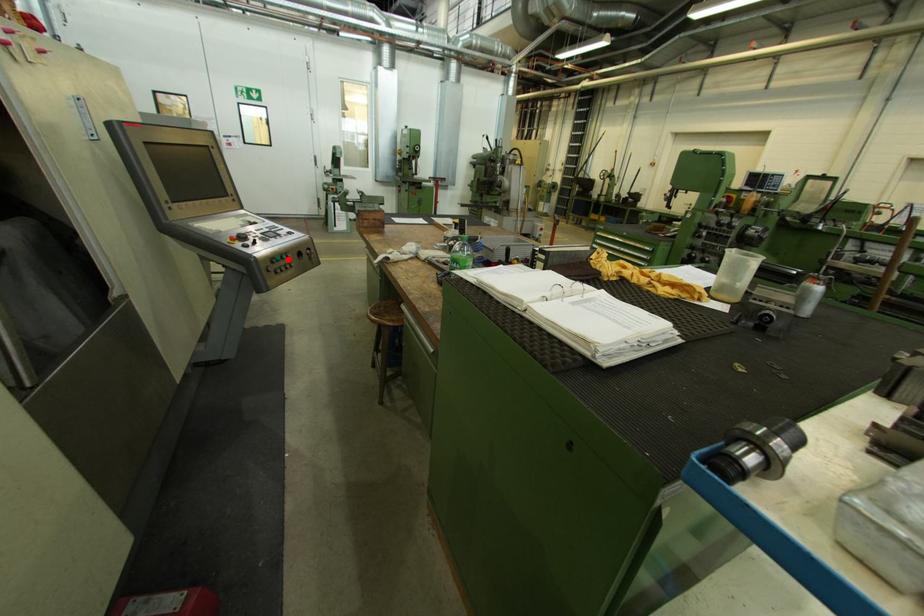
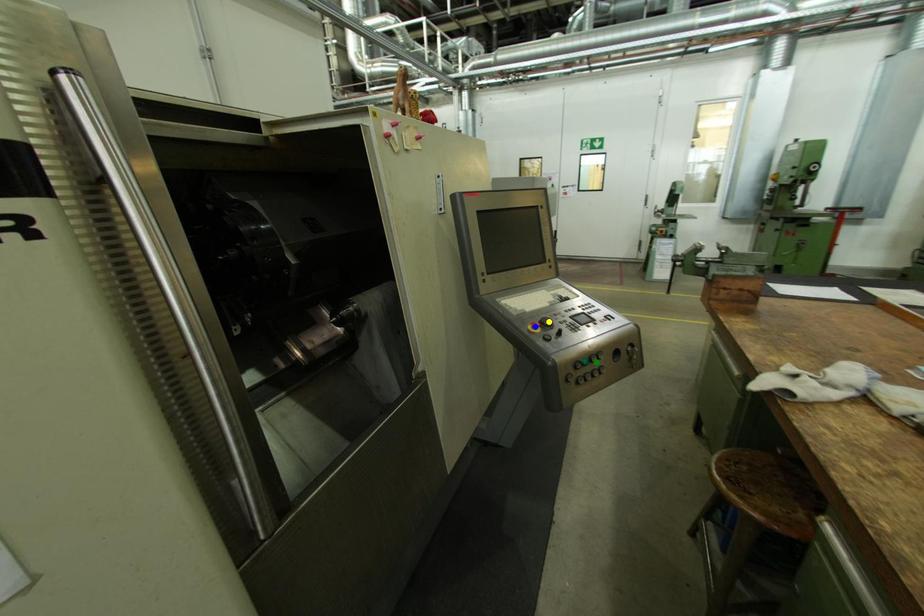
Question: I am providing you with two images of the same scene from different viewpoints. A red point is marked on the first image. You are given multiple points on the second image. In image 2, which mark is for the same physical point as the one in image 1?

Choices:
 (A) yellow point
 (B) blue point
 (C) green point

Answer: (C)